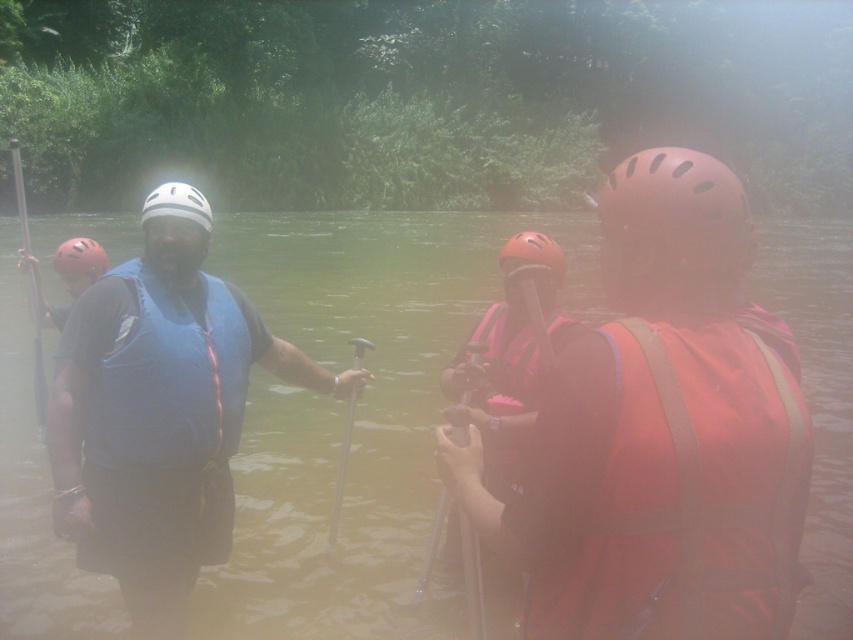
Which of these two, matte black helmet at center or metallic silver paddle at center, stands shorter?

With less height is matte black helmet at center.

Is the position of matte black helmet at center more distant than that of metallic silver paddle at center?

That is False.

The width and height of the screenshot is (853, 640). What do you see at coordinates (532, 253) in the screenshot?
I see `matte black helmet at center` at bounding box center [532, 253].

Identify the location of matte black helmet at center. (532, 253).

Between green murky water at center and white matte helmet at center, which one appears on the left side from the viewer's perspective?

Positioned to the left is white matte helmet at center.

Does green murky water at center have a lesser height compared to white matte helmet at center?

Yes.

Between point (804, 220) and point (198, 193), which one is positioned in front?

Point (198, 193) is more forward.

Identify the location of green murky water at center. The width and height of the screenshot is (853, 640). (357, 413).

Is matte pink life vest at center shorter than metallic silver paddle at center?

Yes, matte pink life vest at center is shorter than metallic silver paddle at center.

Between matte pink life vest at center and metallic silver paddle at center, which one is positioned higher?

Positioned higher is matte pink life vest at center.

Between point (512, 340) and point (352, 406), which one is positioned in front?

Point (512, 340)

The image size is (853, 640). What are the coordinates of `matte pink life vest at center` in the screenshot? It's located at (509, 355).